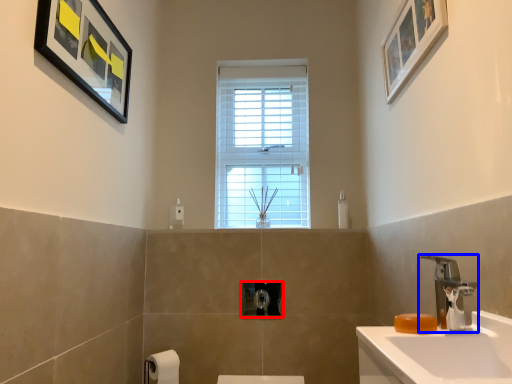
Question: Which object is closer to the camera taking this photo, towel bar (highlighted by a red box) or tap (highlighted by a blue box)?

Choices:
 (A) towel bar
 (B) tap

Answer: (B)